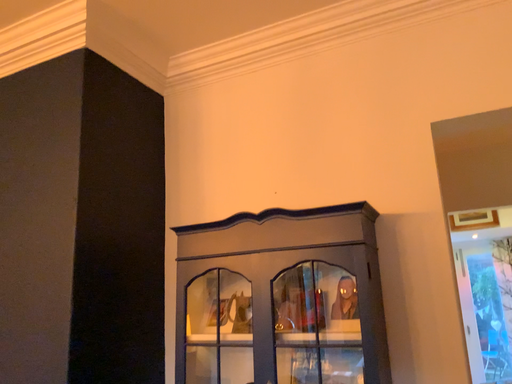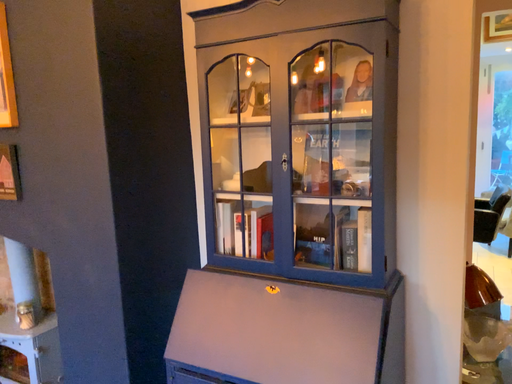
Question: Which way did the camera rotate in the video?

Choices:
 (A) rotated upward
 (B) rotated downward

Answer: (B)